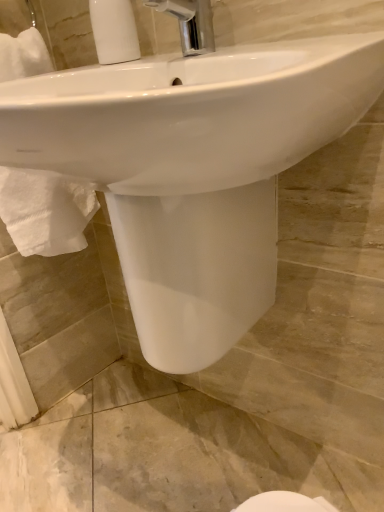
Question: Is white ribbed plastic at upper left facing towards white glossy sink at center?

Choices:
 (A) yes
 (B) no

Answer: (B)

Question: From the image's perspective, does white ribbed plastic at upper left appear higher than white glossy sink at center?

Choices:
 (A) yes
 (B) no

Answer: (A)

Question: Is white ribbed plastic at upper left beside white glossy sink at center?

Choices:
 (A) yes
 (B) no

Answer: (B)

Question: Is white glossy sink at center inside white ribbed plastic at upper left?

Choices:
 (A) yes
 (B) no

Answer: (B)

Question: Is white ribbed plastic at upper left not near white glossy sink at center?

Choices:
 (A) no
 (B) yes

Answer: (A)

Question: Does white ribbed plastic at upper left have a greater height compared to white glossy sink at center?

Choices:
 (A) no
 (B) yes

Answer: (A)

Question: Is the depth of white glossy sink at center greater than that of chrome metallic faucet at upper center?

Choices:
 (A) yes
 (B) no

Answer: (B)

Question: From a real-world perspective, does white glossy sink at center stand above chrome metallic faucet at upper center?

Choices:
 (A) no
 (B) yes

Answer: (A)

Question: Is white glossy sink at center in contact with chrome metallic faucet at upper center?

Choices:
 (A) no
 (B) yes

Answer: (A)

Question: Is white glossy sink at center wider than chrome metallic faucet at upper center?

Choices:
 (A) yes
 (B) no

Answer: (A)

Question: Is white glossy sink at center completely or partially outside of chrome metallic faucet at upper center?

Choices:
 (A) yes
 (B) no

Answer: (A)

Question: Could you tell me if white glossy sink at center is turned towards chrome metallic faucet at upper center?

Choices:
 (A) no
 (B) yes

Answer: (A)

Question: Can you confirm if chrome metallic faucet at upper center is shorter than white ribbed plastic at upper left?

Choices:
 (A) no
 (B) yes

Answer: (B)